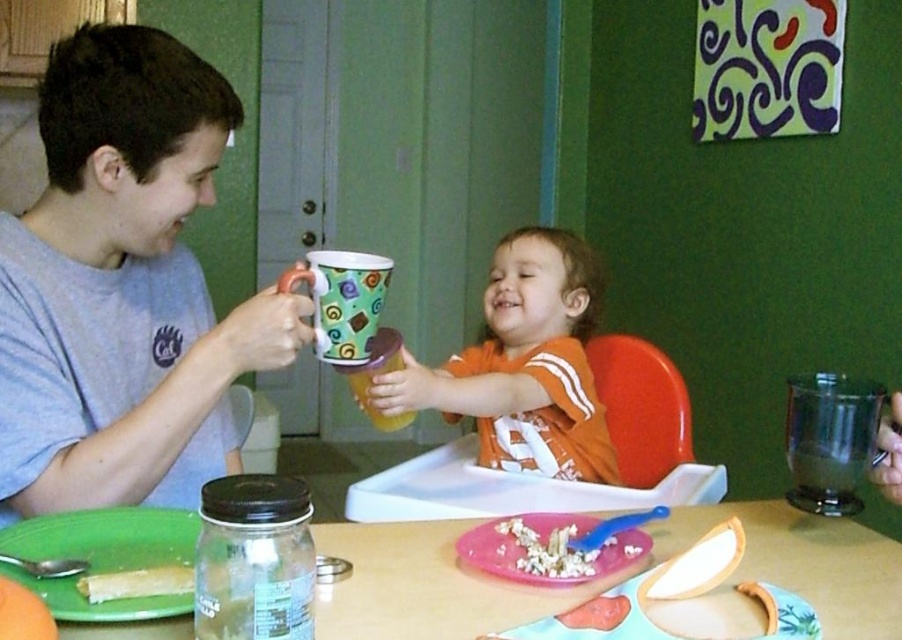
Can you confirm if wooden table at center is positioned to the left of orange plastic chair at center?

Yes, wooden table at center is to the left of orange plastic chair at center.

Looking at this image, is wooden table at center behind orange plastic chair at center?

No, it is not.

Which is behind, point (807, 589) or point (650, 460)?

The point (650, 460) is behind.

Find the location of a particular element. Image resolution: width=902 pixels, height=640 pixels. wooden table at center is located at coordinates (x=422, y=586).

Can you confirm if crumbly white popcorn at center is positioned to the left of smooth pink cake at lower center?

Correct, you'll find crumbly white popcorn at center to the left of smooth pink cake at lower center.

Who is higher up, crumbly white popcorn at center or smooth pink cake at lower center?

crumbly white popcorn at center is above.

Is point (544, 566) less distant than point (605, 611)?

No, (544, 566) is further to viewer.

The height and width of the screenshot is (640, 902). Identify the location of crumbly white popcorn at center. click(550, 550).

Which is more to the right, matte gray t-shirt at left or wooden table at center?

wooden table at center

Can you confirm if matte gray t-shirt at left is smaller than wooden table at center?

Incorrect, matte gray t-shirt at left is not smaller in size than wooden table at center.

Does point (121, 140) come farther from viewer compared to point (347, 579)?

Yes, point (121, 140) is farther from viewer.

Where is `matte gray t-shirt at left`? matte gray t-shirt at left is located at coordinates (123, 285).